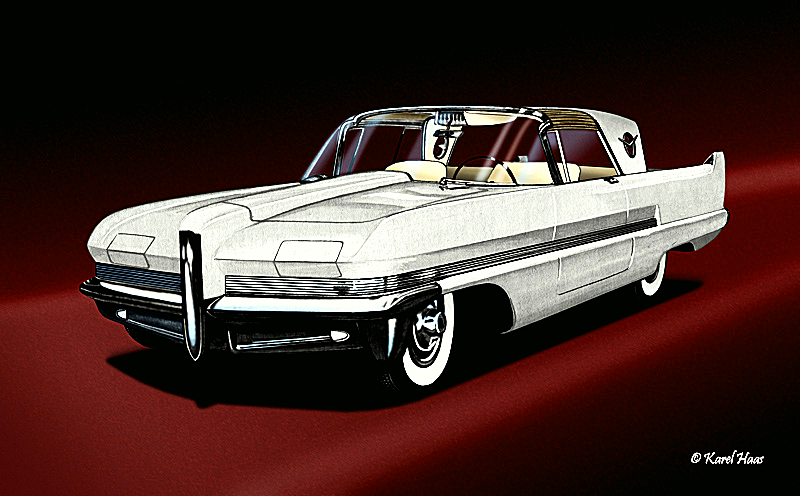
This screenshot has width=800, height=496. What are the coordinates of `white walls` in the screenshot? It's located at (428, 373), (654, 287).